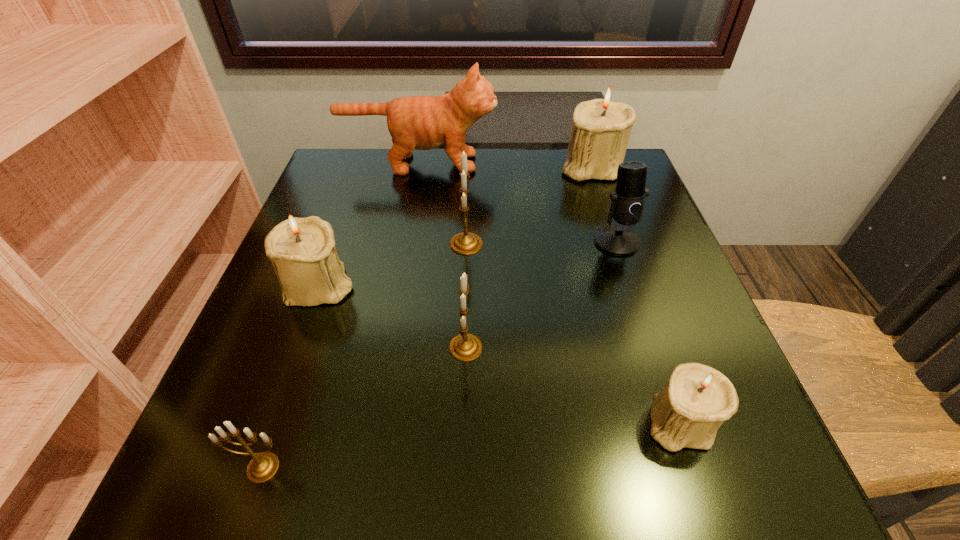
Locate an element on the screen. vacant region at the left edge of the desktop is located at coordinates (228, 393).

At what (x,y) coordinates should I click in order to perform the action: click on vacant space at the right edge. Please return your answer as a coordinate pair (x, y). The image size is (960, 540). Looking at the image, I should click on (661, 299).

In the image, there is a desktop. Where is `vacant area at the far left corner`? The image size is (960, 540). vacant area at the far left corner is located at coordinates (325, 200).

Where is `free point at the near left corner`? free point at the near left corner is located at coordinates (308, 447).

Where is `free space between the third nearest candelabrum and the nearest beige candle_holder`? This screenshot has width=960, height=540. free space between the third nearest candelabrum and the nearest beige candle_holder is located at coordinates (572, 384).

Locate an element on the screen. This screenshot has width=960, height=540. vacant space that is in between the nearest beige candle_holder and the farthest candelabrum is located at coordinates (636, 294).

Identify the location of free space between the smallest gold candelabrum and the cat. Image resolution: width=960 pixels, height=540 pixels. (341, 315).

Identify the location of vacant area that lies between the smallest beige candle_holder and the microphone. This screenshot has width=960, height=540. (648, 332).

Identify the location of unoccupied area between the farthest gold candelabrum and the biggest beige candle_holder. (529, 205).

Identify the location of free space that is in between the farthest candelabrum and the cat. (505, 165).